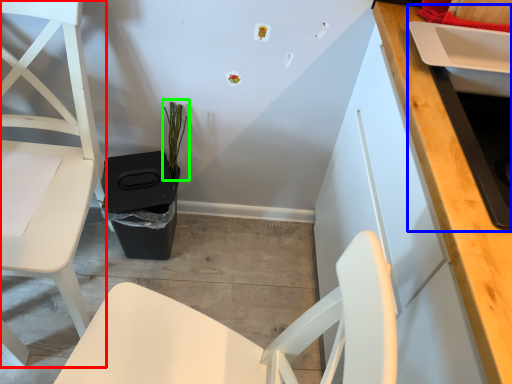
Question: Which object is the closest to the chair (highlighted by a red box)? Choose among these: sink (highlighted by a blue box) or plant (highlighted by a green box).

Choices:
 (A) sink
 (B) plant

Answer: (B)